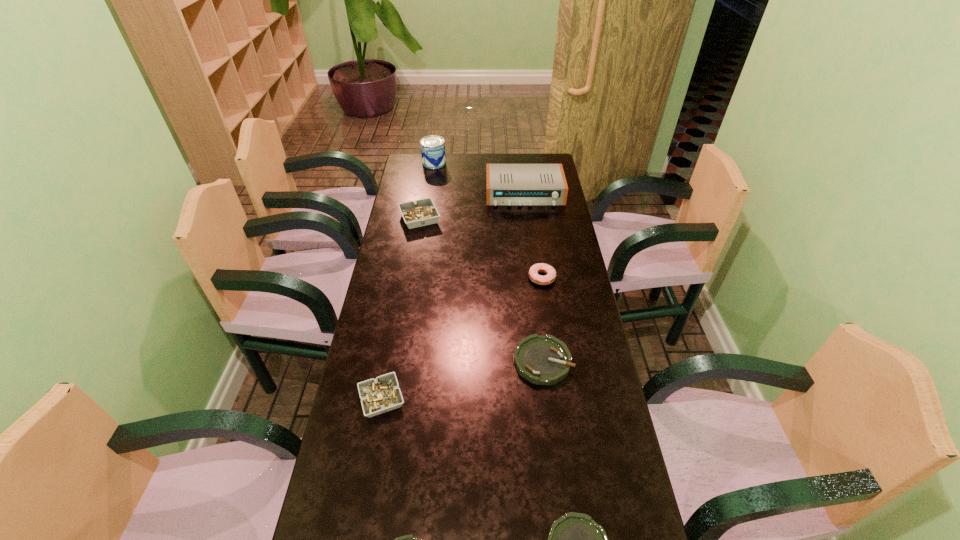
The height and width of the screenshot is (540, 960). I want to click on can, so click(433, 155).

Identify the location of the tallest object. The width and height of the screenshot is (960, 540). (433, 155).

Identify the location of radio receiver. [506, 184].

Where is `the farthest ashtray`? the farthest ashtray is located at coordinates (422, 212).

Find the location of a particular element. Image resolution: width=960 pixels, height=540 pixels. the tallest ashtray is located at coordinates (422, 212).

You are a GUI agent. You are given a task and a screenshot of the screen. Output one action in this format:
    pyautogui.click(x=<x>, y=<y>)
    Task: Click on the fifth nearest object
    
    Given the screenshot: What is the action you would take?
    pyautogui.click(x=540, y=267)

Find the location of `pink doughnut`. pink doughnut is located at coordinates (540, 267).

The height and width of the screenshot is (540, 960). I want to click on the nearer gray ashtray, so click(x=380, y=395).

What are the coordinates of `the farthest green ashtray` in the screenshot? It's located at (542, 360).

Find the location of `free space located 0.090m on the front label of the can`. free space located 0.090m on the front label of the can is located at coordinates (432, 179).